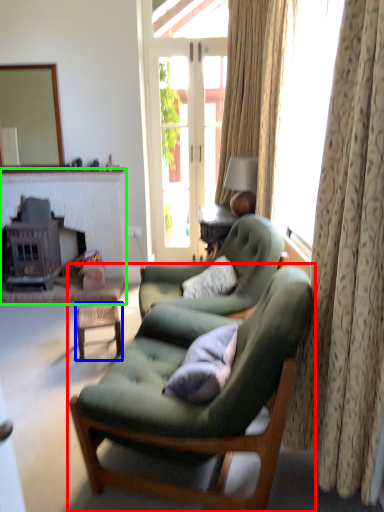
Question: Considering the real-world distances, which object is closest to chair (highlighted by a red box)? table (highlighted by a blue box) or fireplace (highlighted by a green box).

Choices:
 (A) table
 (B) fireplace

Answer: (A)